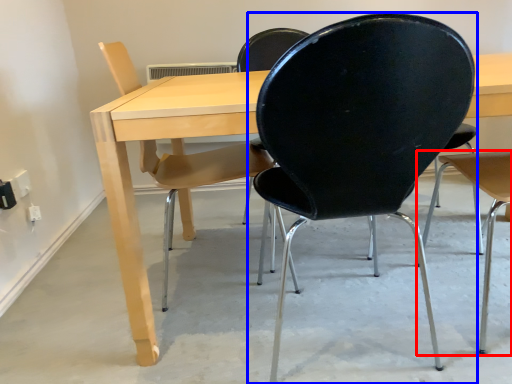
Question: Which of the following is the closest to the observer, chair (highlighted by a red box) or chair (highlighted by a blue box)?

Choices:
 (A) chair
 (B) chair

Answer: (B)